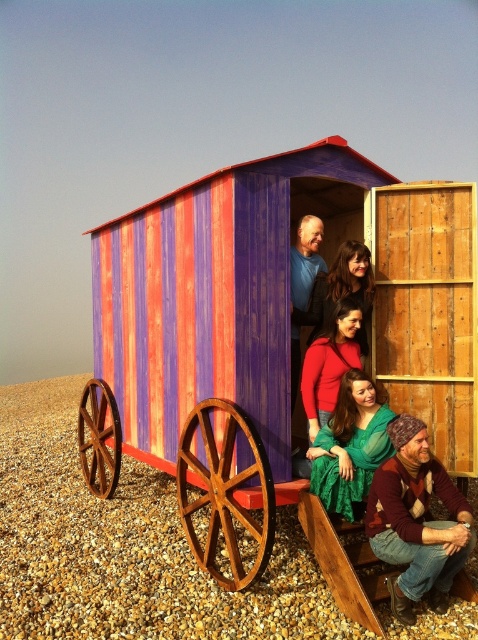
You are standing on the pebble beach and see the knitted woolen hat at lower right and the green sheer dress at center. Which object is closer to the ground?

The knitted woolen hat at lower right is below the green sheer dress at center, so it is closer to the ground.

You are a photographer setting up a shoot on the pebble beach. You have a knitted woolen hat at lower right and a green sheer dress at center. Which object would require more space to frame in your camera shot?

The knitted woolen hat at lower right is bigger than the green sheer dress at center, so it would require more space to frame in your camera shot.

You are standing on the pebble beach and see the wooden cabin at center and the matte red sweater at center. Which object is higher up in the image?

The wooden cabin at center is located above the matte red sweater at center, so it is higher up in the image.